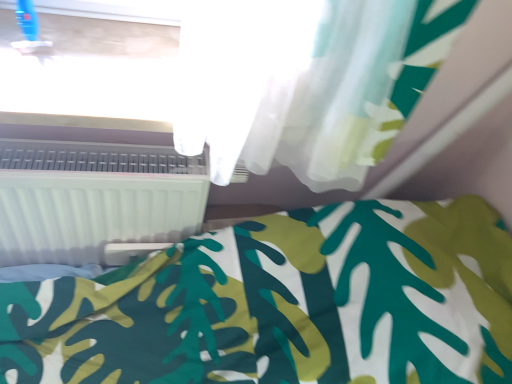
Question: Is white plastic window frame at upper center thinner than white plastic radiator at lower left?

Choices:
 (A) no
 (B) yes

Answer: (A)

Question: Could you tell me if white plastic window frame at upper center is turned towards white plastic radiator at lower left?

Choices:
 (A) yes
 (B) no

Answer: (B)

Question: Can you confirm if white plastic window frame at upper center is bigger than white plastic radiator at lower left?

Choices:
 (A) yes
 (B) no

Answer: (B)

Question: Would you say white plastic window frame at upper center is a long distance from white plastic radiator at lower left?

Choices:
 (A) yes
 (B) no

Answer: (B)

Question: Is white plastic window frame at upper center shorter than white plastic radiator at lower left?

Choices:
 (A) no
 (B) yes

Answer: (B)

Question: Does point (494, 382) appear closer or farther from the camera than point (147, 72)?

Choices:
 (A) closer
 (B) farther

Answer: (A)

Question: Is white fabric bed at lower right in front of or behind white plastic window frame at upper center in the image?

Choices:
 (A) front
 (B) behind

Answer: (A)

Question: From the image's perspective, is white fabric bed at lower right above or below white plastic window frame at upper center?

Choices:
 (A) below
 (B) above

Answer: (A)

Question: Would you say white fabric bed at lower right is to the left or to the right of white plastic window frame at upper center in the picture?

Choices:
 (A) right
 (B) left

Answer: (A)

Question: In terms of height, does white plastic radiator at lower left look taller or shorter compared to white plastic window frame at upper center?

Choices:
 (A) tall
 (B) short

Answer: (A)

Question: From a real-world perspective, is white plastic radiator at lower left physically located above or below white plastic window frame at upper center?

Choices:
 (A) below
 (B) above

Answer: (A)

Question: Is point (168, 158) closer or farther from the camera than point (64, 44)?

Choices:
 (A) closer
 (B) farther

Answer: (B)

Question: Relative to white plastic window frame at upper center, is white plastic radiator at lower left in front or behind?

Choices:
 (A) behind
 (B) front

Answer: (A)

Question: In terms of height, does white plastic window frame at upper center look taller or shorter compared to white plastic radiator at lower left?

Choices:
 (A) tall
 (B) short

Answer: (B)

Question: From the image's perspective, is white plastic window frame at upper center above or below white plastic radiator at lower left?

Choices:
 (A) above
 (B) below

Answer: (A)